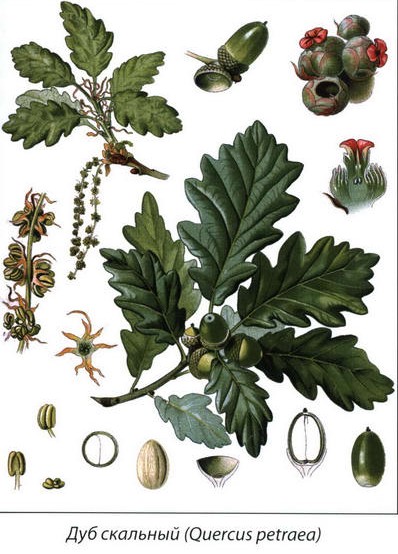
Find the location of `green and red plant top right`. green and red plant top right is located at coordinates (341, 48).